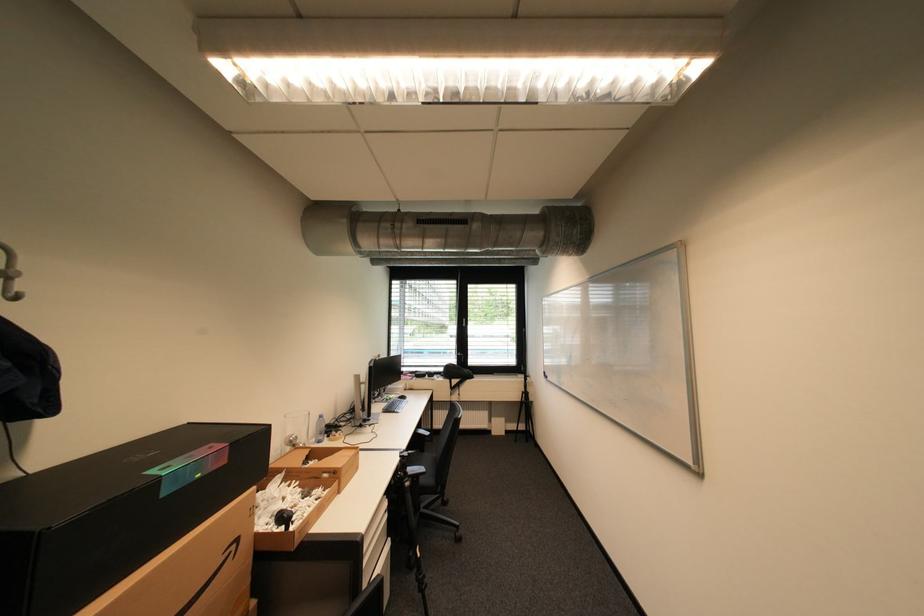
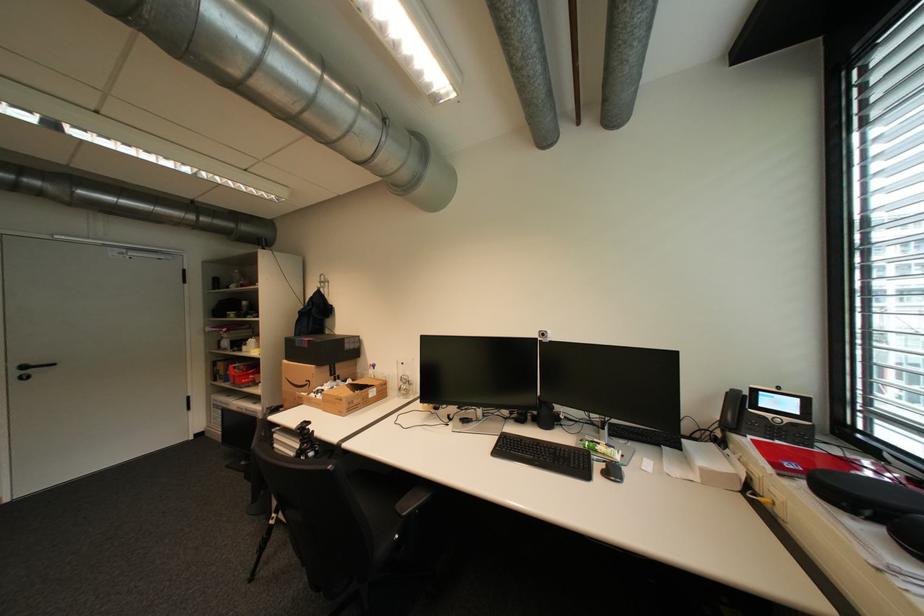
Locate, in the second image, the point that corresponds to point 242,546 in the first image.

(317, 383)